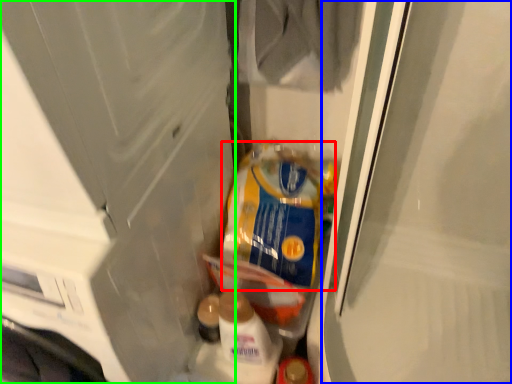
Question: Which is farther away from product (highlighted by a red box)? screen door (highlighted by a blue box) or screen door (highlighted by a green box)?

Choices:
 (A) screen door
 (B) screen door

Answer: (B)